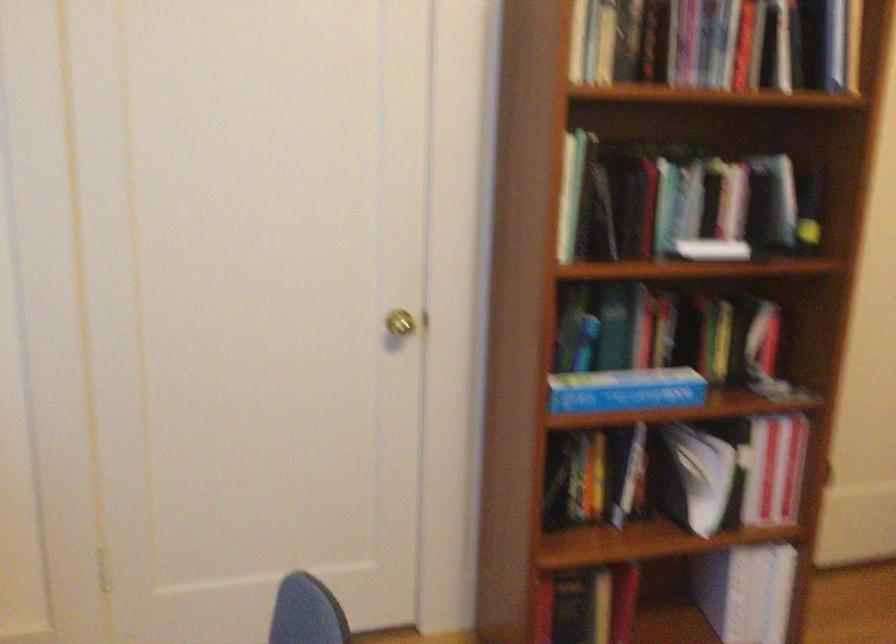
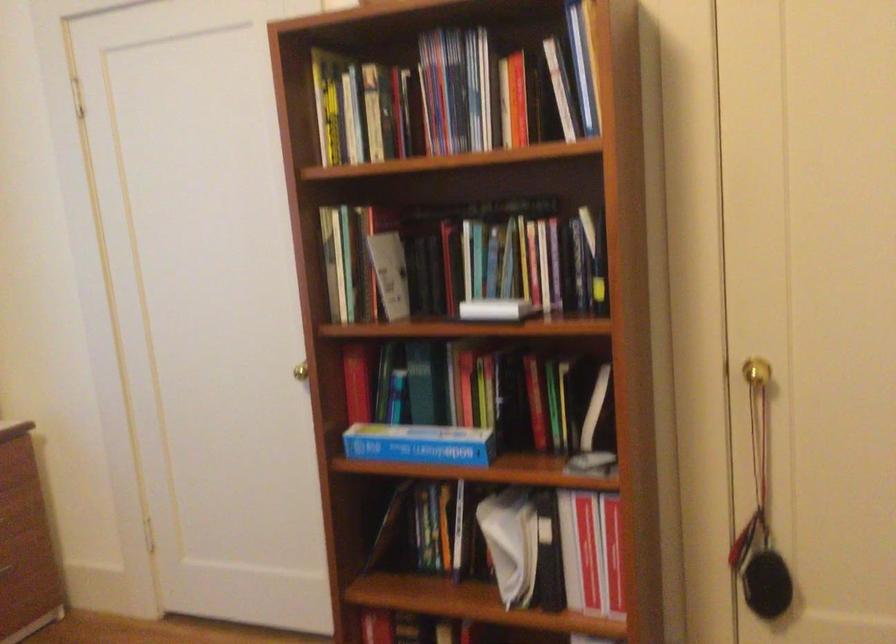
Locate, in the second image, the point that corresponds to point 655,198 in the first image.

(467, 260)